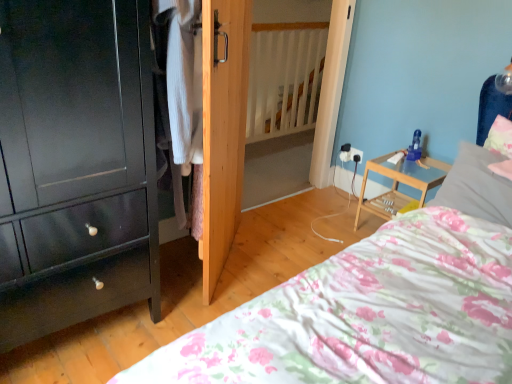
Question: Is natural wood door at center outside fluffy pink pillow at upper right, the 2th pillow when ordered from left to right?

Choices:
 (A) yes
 (B) no

Answer: (A)

Question: Is natural wood door at center closer to camera compared to fluffy pink pillow at upper right, the 2th pillow when ordered from left to right?

Choices:
 (A) no
 (B) yes

Answer: (B)

Question: Could you tell me if natural wood door at center is turned towards fluffy pink pillow at upper right, the 2th pillow when ordered from left to right?

Choices:
 (A) yes
 (B) no

Answer: (A)

Question: Would you consider natural wood door at center to be distant from fluffy pink pillow at upper right, the first pillow in the right-to-left sequence?

Choices:
 (A) yes
 (B) no

Answer: (A)

Question: Can you confirm if natural wood door at center is shorter than fluffy pink pillow at upper right, the 2th pillow when ordered from left to right?

Choices:
 (A) yes
 (B) no

Answer: (B)

Question: In terms of height, does blue plastic toy at upper right look taller or shorter compared to fluffy pink pillow at upper right, the 2th pillow when ordered from left to right?

Choices:
 (A) short
 (B) tall

Answer: (A)

Question: Considering the positions of blue plastic toy at upper right and fluffy pink pillow at upper right, the first pillow in the right-to-left sequence, in the image, is blue plastic toy at upper right wider or thinner than fluffy pink pillow at upper right, the first pillow in the right-to-left sequence,?

Choices:
 (A) thin
 (B) wide

Answer: (A)

Question: Choose the correct answer: Is blue plastic toy at upper right inside fluffy pink pillow at upper right, the first pillow in the right-to-left sequence, or outside it?

Choices:
 (A) outside
 (B) inside

Answer: (A)

Question: Is blue plastic toy at upper right to the left or to the right of fluffy pink pillow at upper right, the first pillow in the right-to-left sequence, in the image?

Choices:
 (A) left
 (B) right

Answer: (A)

Question: Relative to knitted wool sweater at center, is white soft pillow at upper right, which is the 1th pillow from left to right, in front or behind?

Choices:
 (A) behind
 (B) front

Answer: (A)

Question: In the image, is white soft pillow at upper right, which is the 1th pillow from left to right, on the left side or the right side of knitted wool sweater at center?

Choices:
 (A) left
 (B) right

Answer: (B)

Question: Is white soft pillow at upper right, which is the 1th pillow from left to right, bigger or smaller than knitted wool sweater at center?

Choices:
 (A) small
 (B) big

Answer: (A)

Question: Is point click(501, 210) closer or farther from the camera than point click(200, 208)?

Choices:
 (A) farther
 (B) closer

Answer: (B)

Question: From their relative heights in the image, would you say fluffy pink pillow at upper right, the first pillow in the right-to-left sequence, is taller or shorter than blue plastic toy at upper right?

Choices:
 (A) short
 (B) tall

Answer: (B)

Question: Relative to blue plastic toy at upper right, is fluffy pink pillow at upper right, the first pillow in the right-to-left sequence, in front or behind?

Choices:
 (A) behind
 (B) front

Answer: (B)